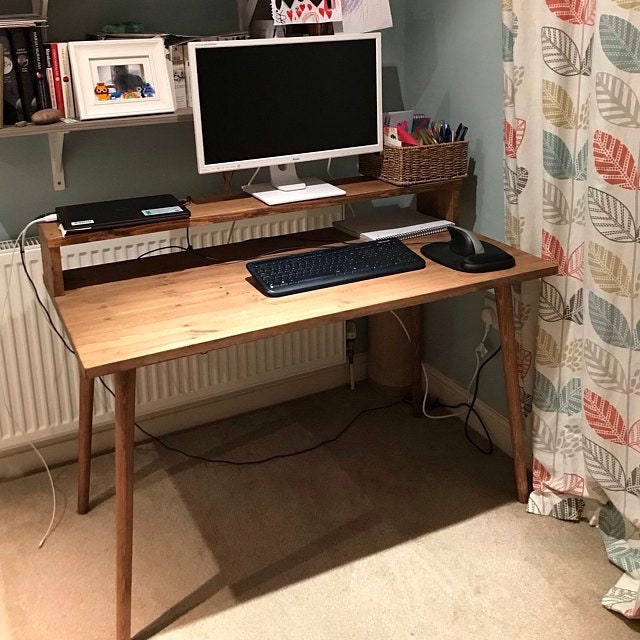
Find the location of a particular element. wall is located at coordinates (470, 92).